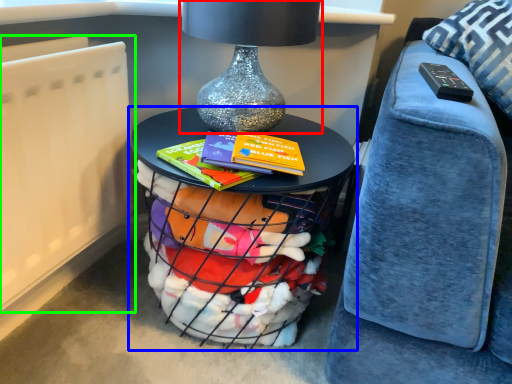
Question: Considering the real-world distances, which object is farthest from table lamp (highlighted by a red box)? table (highlighted by a blue box) or radiator (highlighted by a green box)?

Choices:
 (A) table
 (B) radiator

Answer: (B)